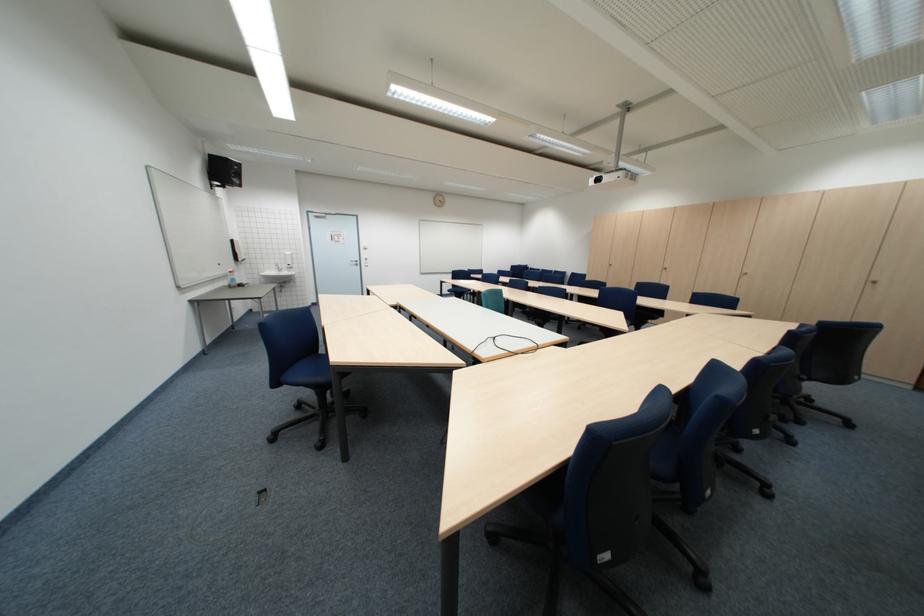
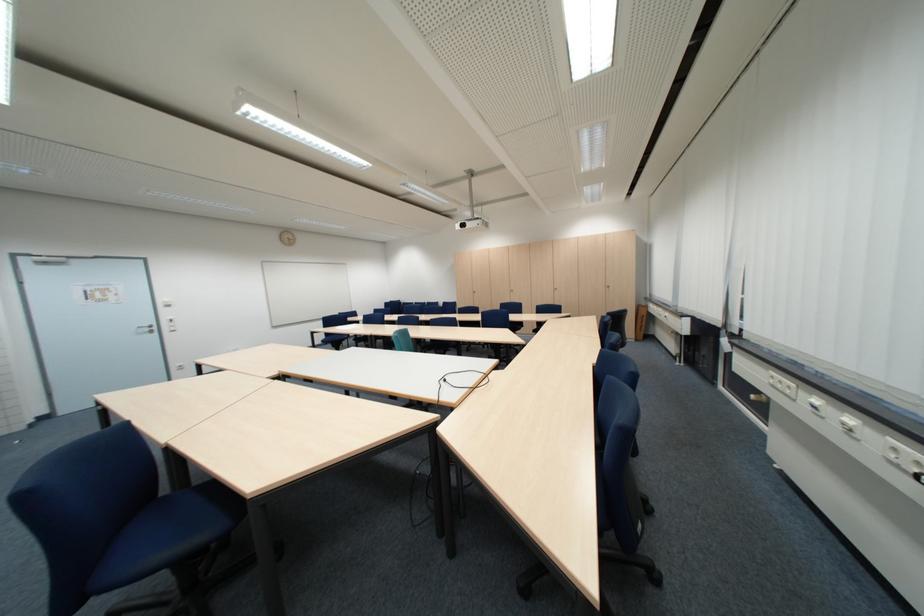
Question: The camera is either moving clockwise (left) or counter-clockwise (right) around the object. The first image is from the beginning of the video and the second image is from the end. Is the camera moving left or right when shooting the video?

Choices:
 (A) Left
 (B) Right

Answer: (A)